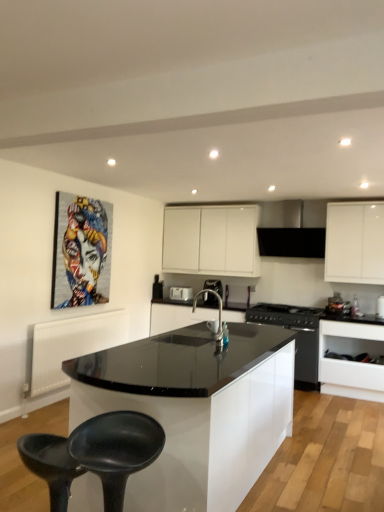
Where is `vacant area on top of metallic textured portrait at upper left (from a real-world perspective)`? Image resolution: width=384 pixels, height=512 pixels. vacant area on top of metallic textured portrait at upper left (from a real-world perspective) is located at coordinates (86, 196).